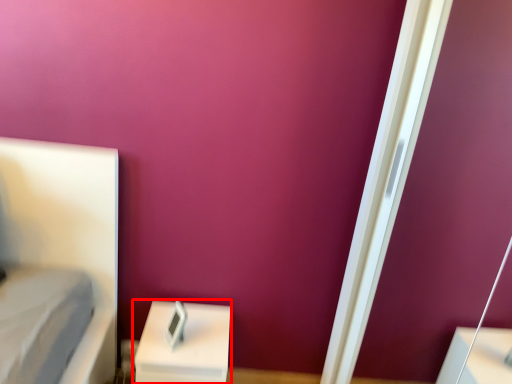
Question: From the image's perspective, what is the correct spatial relationship of furniture (annotated by the red box) in relation to screen door?

Choices:
 (A) above
 (B) below

Answer: (B)